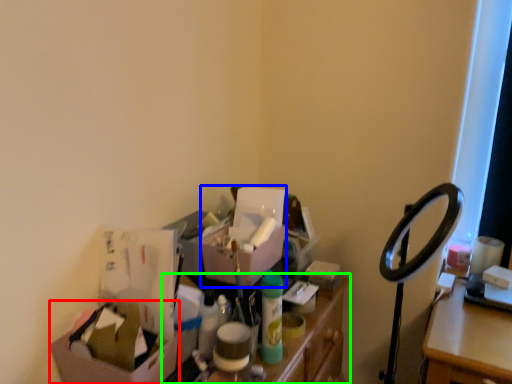
Question: Estimate the real-world distances between objects in this image. Which object is closer to box (highlighted by a red box), box (highlighted by a blue box) or furniture (highlighted by a green box)?

Choices:
 (A) box
 (B) furniture

Answer: (B)